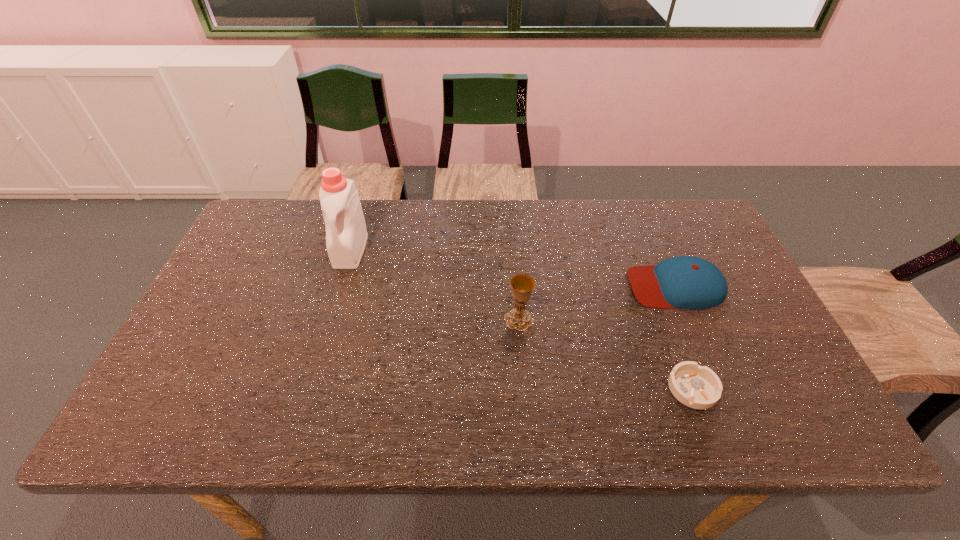
The height and width of the screenshot is (540, 960). What are the coordinates of `object that is the third closest one to the third shortest object` in the screenshot? It's located at (346, 236).

Where is `free space that satisfies the following two spatial constraints: 1. on the handle side of the detergent; 2. on the left side of the ashtray`? The height and width of the screenshot is (540, 960). free space that satisfies the following two spatial constraints: 1. on the handle side of the detergent; 2. on the left side of the ashtray is located at coordinates (308, 388).

Find the location of `vacant position in the image that satisfies the following two spatial constraints: 1. on the handle side of the nearest object; 2. on the right side of the detergent`. vacant position in the image that satisfies the following two spatial constraints: 1. on the handle side of the nearest object; 2. on the right side of the detergent is located at coordinates (308, 388).

At what (x,y) coordinates should I click in order to perform the action: click on free space that satisfies the following two spatial constraints: 1. on the handle side of the chalice; 2. on the right side of the tallest object. Please return your answer as a coordinate pair (x, y). The width and height of the screenshot is (960, 540). Looking at the image, I should click on (329, 320).